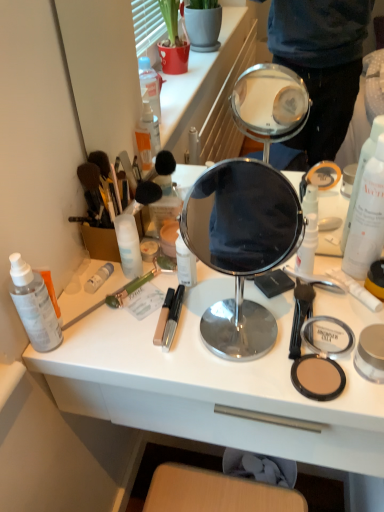
Image resolution: width=384 pixels, height=512 pixels. Find the location of `empty space that is in between polished silver mirror at center and white matte bottle at center-left, acting as the fourth toiletry starting from the left`. empty space that is in between polished silver mirror at center and white matte bottle at center-left, acting as the fourth toiletry starting from the left is located at coordinates (184, 296).